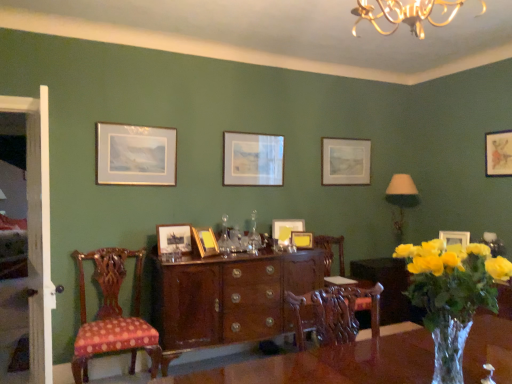
Question: Does yellow matte picture frame at center, the fifth picture frame viewed from the right, have a greater height compared to matte gold picture frame at upper right, the 8th picture frame from the left?

Choices:
 (A) no
 (B) yes

Answer: (B)

Question: Is yellow matte picture frame at center, the fifth picture frame viewed from the right, positioned with its back to matte gold picture frame at upper right, which is the second picture frame in right-to-left order?

Choices:
 (A) yes
 (B) no

Answer: (B)

Question: Is yellow matte picture frame at center, the fifth picture frame viewed from the right, shorter than matte gold picture frame at upper right, the 8th picture frame from the left?

Choices:
 (A) no
 (B) yes

Answer: (A)

Question: Are yellow matte picture frame at center, the fifth picture frame viewed from the right, and matte gold picture frame at upper right, which is the second picture frame in right-to-left order, far apart?

Choices:
 (A) no
 (B) yes

Answer: (B)

Question: Is matte gold picture frame at upper right, the 8th picture frame from the left, surrounded by yellow matte picture frame at center, the fifth picture frame viewed from the right?

Choices:
 (A) yes
 (B) no

Answer: (B)

Question: From a real-world perspective, is yellow matte picture frame at center, the fifth picture frame viewed from the right, above or below glossy wood cabinet at center?

Choices:
 (A) below
 (B) above

Answer: (B)

Question: Considering the positions of yellow matte picture frame at center, the fifth picture frame viewed from the right, and glossy wood cabinet at center in the image, is yellow matte picture frame at center, the fifth picture frame viewed from the right, wider or thinner than glossy wood cabinet at center?

Choices:
 (A) wide
 (B) thin

Answer: (B)

Question: In terms of size, does yellow matte picture frame at center, the fifth picture frame viewed from the right, appear bigger or smaller than glossy wood cabinet at center?

Choices:
 (A) small
 (B) big

Answer: (A)

Question: Considering their positions, is yellow matte picture frame at center, the fifth picture frame viewed from the right, located in front of or behind glossy wood cabinet at center?

Choices:
 (A) front
 (B) behind

Answer: (B)

Question: From a real-world perspective, relative to gold-framed print at upper left, which ranks as the 9th picture frame in right-to-left order, is glossy wood cabinet at center vertically above or below?

Choices:
 (A) above
 (B) below

Answer: (B)

Question: Is point (268, 274) positioned closer to the camera than point (136, 145)?

Choices:
 (A) farther
 (B) closer

Answer: (B)

Question: From their relative heights in the image, would you say glossy wood cabinet at center is taller or shorter than gold-framed print at upper left, which ranks as the 1th picture frame in left-to-right order?

Choices:
 (A) tall
 (B) short

Answer: (A)

Question: Would you say glossy wood cabinet at center is inside or outside gold-framed print at upper left, which ranks as the 1th picture frame in left-to-right order?

Choices:
 (A) outside
 (B) inside

Answer: (A)

Question: Considering their positions, is mahogany wood chair at center, arranged as the 1th chair when viewed from the right, located in front of or behind matte gold picture frame at upper right, the first picture frame viewed from the right?

Choices:
 (A) behind
 (B) front

Answer: (B)

Question: Considering the positions of mahogany wood chair at center, the first chair viewed from the back, and matte gold picture frame at upper right, the first picture frame viewed from the right, in the image, is mahogany wood chair at center, the first chair viewed from the back, wider or thinner than matte gold picture frame at upper right, the first picture frame viewed from the right,?

Choices:
 (A) wide
 (B) thin

Answer: (A)